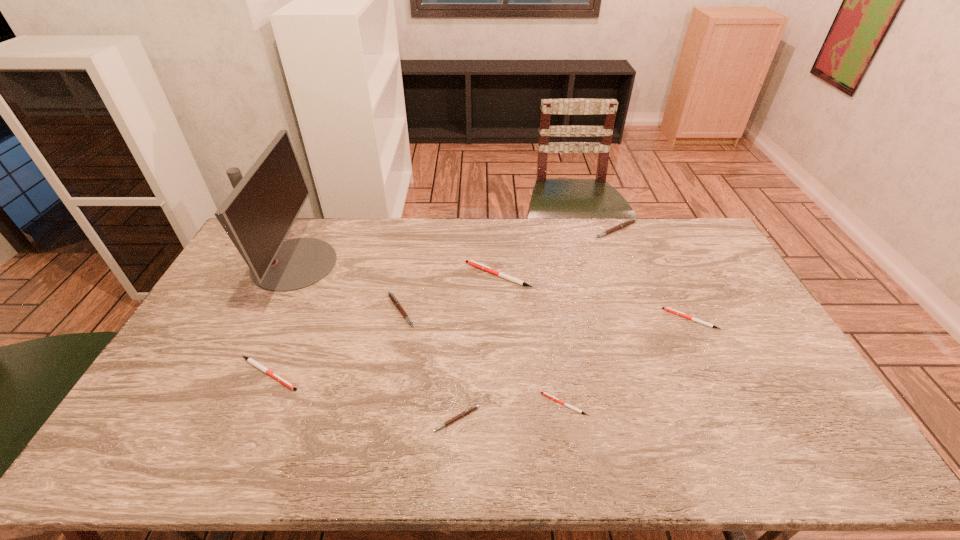
I want to click on the smallest pink pen, so click(x=466, y=412).

Where is `the nearest pink pen`? the nearest pink pen is located at coordinates (466, 412).

You are a GUI agent. You are given a task and a screenshot of the screen. Output one action in this format:
    pyautogui.click(x=<x>, y=<y>)
    Task: Click on the third biggest white pen
    
    Given the screenshot: What is the action you would take?
    pyautogui.click(x=667, y=309)

The image size is (960, 540). I want to click on the rightmost white pen, so click(x=667, y=309).

You are a GUI agent. You are given a task and a screenshot of the screen. Output one action in this format:
    pyautogui.click(x=<x>, y=<y>)
    Task: Click on the nearest white pen
    Image resolution: width=960 pixels, height=540 pixels.
    Given the screenshot: What is the action you would take?
    tap(543, 393)

Image resolution: width=960 pixels, height=540 pixels. I want to click on the shortest pen, so click(543, 393).

Find the location of a particular element. Image resolution: width=960 pixels, height=540 pixels. vacant space situated on the screen of the tallest object is located at coordinates (349, 264).

The height and width of the screenshot is (540, 960). I want to click on free location located 0.370m at the nib of the farthest pen, so click(646, 310).

This screenshot has width=960, height=540. What are the coordinates of `free spot located 0.290m on the clicker of the biggest white pen` in the screenshot? It's located at (382, 275).

Find the location of `vacant space located 0.340m on the clicker of the biggest white pen`. vacant space located 0.340m on the clicker of the biggest white pen is located at coordinates (368, 275).